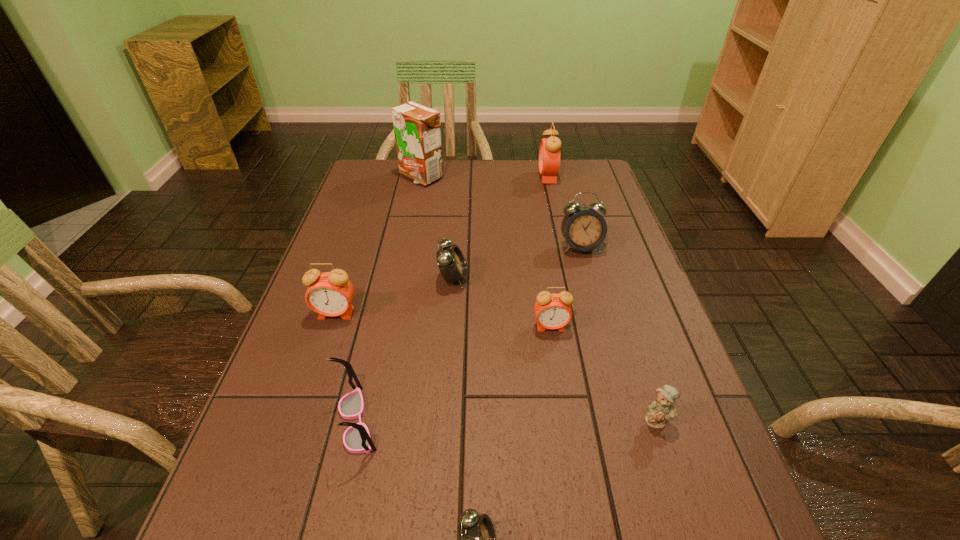
This screenshot has height=540, width=960. What are the coordinates of `free space that satisfies the following two spatial constraints: 1. on the face of the second biggest white alarm clock; 2. on the face of the second smallest pink alarm clock` in the screenshot? It's located at (451, 314).

You are a GUI agent. You are given a task and a screenshot of the screen. Output one action in this format:
    pyautogui.click(x=<x>, y=<y>)
    Task: Click on the vacant space that satisfies the following two spatial constraints: 1. on the face of the second tallest object; 2. on the face of the second smallest pink alarm clock
    The width and height of the screenshot is (960, 540).
    Given the screenshot: What is the action you would take?
    pyautogui.click(x=578, y=314)

Locate an element on the screen. This screenshot has width=960, height=540. free location that satisfies the following two spatial constraints: 1. on the face of the fifth nearest alarm clock; 2. on the face of the second smallest white alarm clock is located at coordinates point(589,279).

You are a GUI agent. You are given a task and a screenshot of the screen. Output one action in this format:
    pyautogui.click(x=<x>, y=<y>)
    Task: Click on the vacant region that satisfies the following two spatial constraints: 1. on the face of the rightmost pink alarm clock; 2. on the straw side of the tallest object
    The image size is (960, 540).
    Given the screenshot: What is the action you would take?
    pyautogui.click(x=547, y=177)